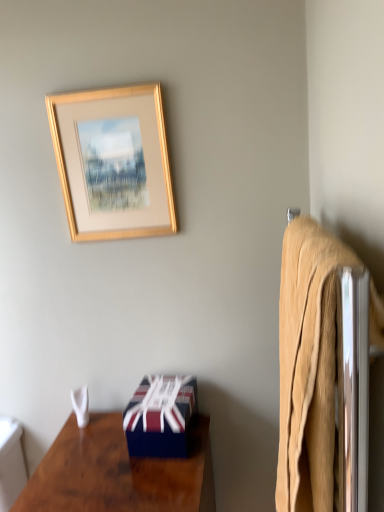
Question: Is white fabric towel at lower left at the back of beige cotton bath towel at right?

Choices:
 (A) no
 (B) yes

Answer: (A)

Question: Is beige cotton bath towel at right thinner than white fabric towel at lower left?

Choices:
 (A) yes
 (B) no

Answer: (A)

Question: From the image's perspective, does beige cotton bath towel at right appear lower than white fabric towel at lower left?

Choices:
 (A) yes
 (B) no

Answer: (B)

Question: Is beige cotton bath towel at right positioned beyond the bounds of white fabric towel at lower left?

Choices:
 (A) no
 (B) yes

Answer: (B)

Question: From the image's perspective, is beige cotton bath towel at right above white fabric towel at lower left?

Choices:
 (A) no
 (B) yes

Answer: (B)

Question: Does beige cotton bath towel at right have a smaller size compared to white fabric towel at lower left?

Choices:
 (A) no
 (B) yes

Answer: (A)

Question: Does shiny dark wood desk at lower left have a lesser width compared to gold wooden picture frame at upper center?

Choices:
 (A) no
 (B) yes

Answer: (A)

Question: Is shiny dark wood desk at lower left further to the viewer compared to gold wooden picture frame at upper center?

Choices:
 (A) yes
 (B) no

Answer: (B)

Question: From a real-world perspective, is shiny dark wood desk at lower left located beneath gold wooden picture frame at upper center?

Choices:
 (A) no
 (B) yes

Answer: (B)

Question: Considering the relative sizes of shiny dark wood desk at lower left and gold wooden picture frame at upper center in the image provided, is shiny dark wood desk at lower left wider than gold wooden picture frame at upper center?

Choices:
 (A) no
 (B) yes

Answer: (B)

Question: From a real-world perspective, does shiny dark wood desk at lower left stand above gold wooden picture frame at upper center?

Choices:
 (A) no
 (B) yes

Answer: (A)

Question: Is shiny dark wood desk at lower left oriented away from gold wooden picture frame at upper center?

Choices:
 (A) no
 (B) yes

Answer: (A)

Question: Is shiny dark wood desk at lower left facing towards beige cotton bath towel at right?

Choices:
 (A) yes
 (B) no

Answer: (B)